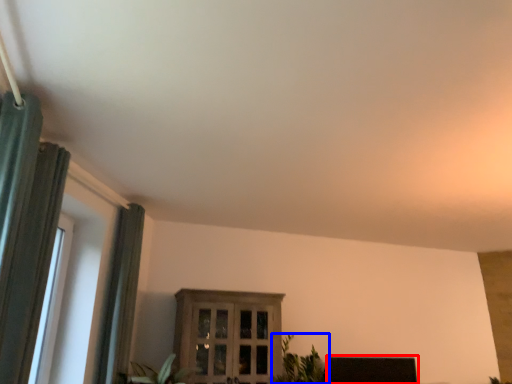
Question: Which object is closer to the camera taking this photo, furniture (highlighted by a red box) or houseplant (highlighted by a blue box)?

Choices:
 (A) furniture
 (B) houseplant

Answer: (B)